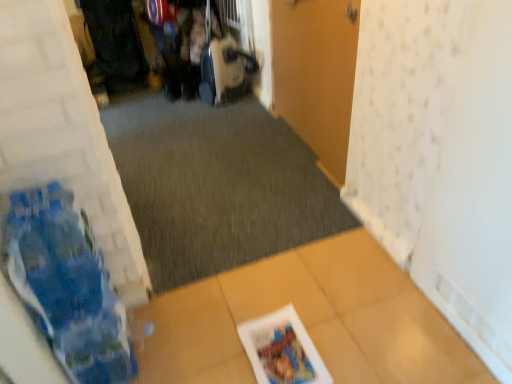
Question: Is dark gray carpet at center behind wooden door at center?

Choices:
 (A) no
 (B) yes

Answer: (B)

Question: Is dark gray carpet at center touching wooden door at center?

Choices:
 (A) no
 (B) yes

Answer: (A)

Question: From a real-world perspective, is dark gray carpet at center under wooden door at center?

Choices:
 (A) no
 (B) yes

Answer: (B)

Question: Is dark gray carpet at center smaller than wooden door at center?

Choices:
 (A) no
 (B) yes

Answer: (A)

Question: Considering the relative sizes of dark gray carpet at center and wooden door at center in the image provided, is dark gray carpet at center wider than wooden door at center?

Choices:
 (A) no
 (B) yes

Answer: (B)

Question: Can you confirm if dark gray carpet at center is bigger than wooden door at center?

Choices:
 (A) yes
 (B) no

Answer: (A)

Question: Is wooden door at center closer to camera compared to dark gray carpet at center?

Choices:
 (A) yes
 (B) no

Answer: (A)

Question: Is wooden door at center placed right next to dark gray carpet at center?

Choices:
 (A) no
 (B) yes

Answer: (A)

Question: Is wooden door at center facing away from dark gray carpet at center?

Choices:
 (A) yes
 (B) no

Answer: (B)

Question: Is wooden door at center further to camera compared to dark gray carpet at center?

Choices:
 (A) no
 (B) yes

Answer: (A)

Question: Is wooden door at center far away from dark gray carpet at center?

Choices:
 (A) no
 (B) yes

Answer: (A)

Question: Is wooden door at center facing towards dark gray carpet at center?

Choices:
 (A) no
 (B) yes

Answer: (B)

Question: From a real-world perspective, is dark gray carpet at center on printed paper magazine at lower center?

Choices:
 (A) no
 (B) yes

Answer: (A)